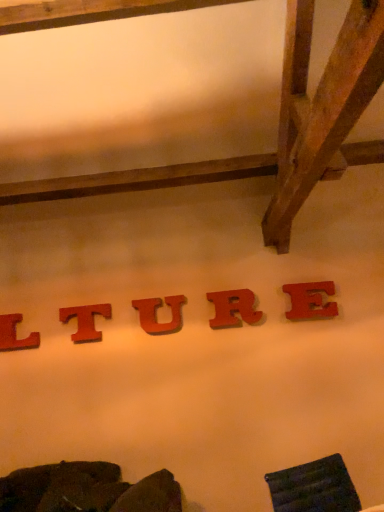
Question: In terms of width, does matte wood letter r at center, arranged as the 4th letter when viewed from the left, look wider or thinner when compared to velvet dark green swivel chair at lower right?

Choices:
 (A) thin
 (B) wide

Answer: (A)

Question: Which is correct: matte wood letter r at center, which appears as the 2th letter when viewed from the right, is inside velvet dark green swivel chair at lower right, or outside of it?

Choices:
 (A) outside
 (B) inside

Answer: (A)

Question: Which is farther from the red wood letter at lower left, the first letter in the left-to-right sequence?

Choices:
 (A) matte wood letter u at center, the 3th letter from the right
 (B) matte wood letter t at center, the second letter in the left-to-right sequence
 (C) red matte letter e at center, arranged as the first letter when viewed from the right
 (D) matte wood letter r at center, which appears as the 2th letter when viewed from the right
 (E) velvet dark green swivel chair at lower right

Answer: (E)

Question: Based on their relative distances, which object is nearer to the matte wood letter u at center, which is the 3th letter in left-to-right order?

Choices:
 (A) red wood letter at lower left, the first letter in the left-to-right sequence
 (B) matte wood letter r at center, arranged as the 4th letter when viewed from the left
 (C) red matte letter e at center, the fifth letter viewed from the left
 (D) matte wood letter t at center, which is counted as the 4th letter, starting from the right
 (E) velvet dark green swivel chair at lower right

Answer: (B)